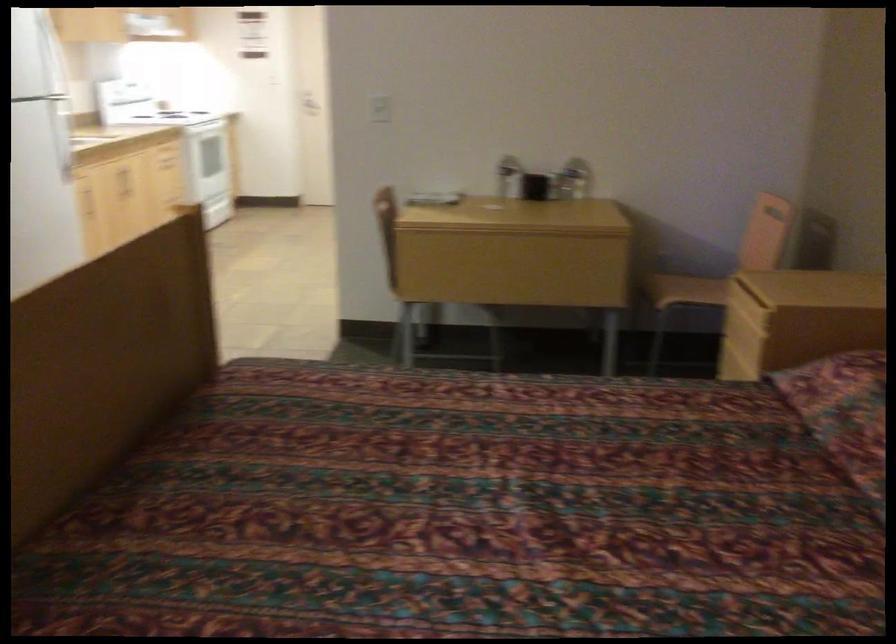
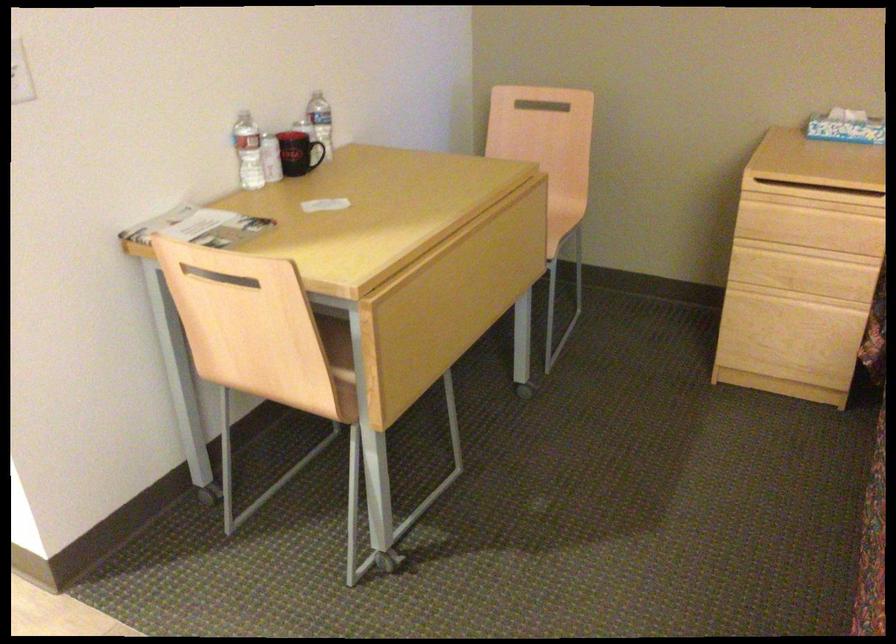
Find the pixel in the second image that matches point 572,169 in the first image.

(321, 122)